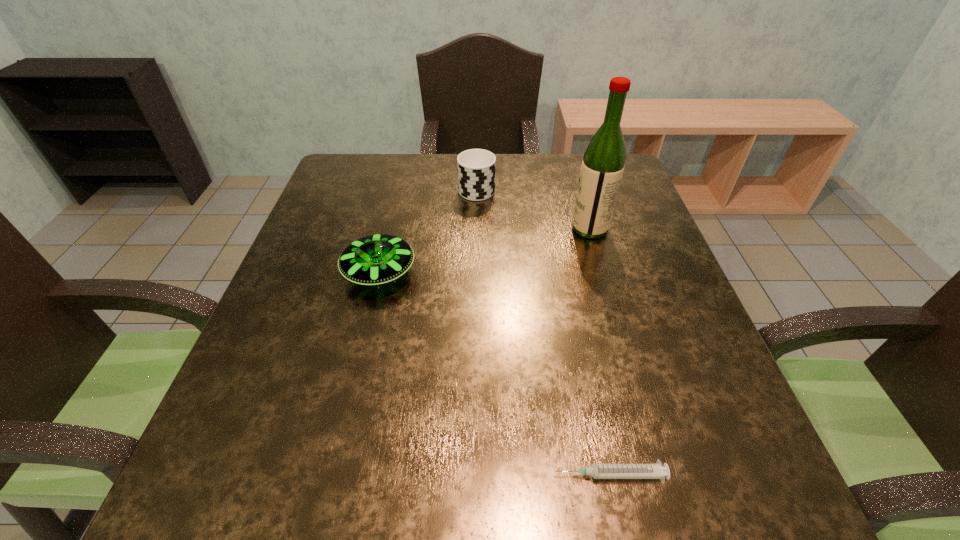
The image size is (960, 540). I want to click on liquor positioned at the right edge, so click(x=603, y=164).

The image size is (960, 540). I want to click on syringe at the right edge, so click(598, 471).

Identify the location of object at the near right corner. (598, 471).

Locate an element on the screen. free space at the far edge is located at coordinates (443, 164).

Locate an element on the screen. This screenshot has height=540, width=960. vacant space at the near edge of the desktop is located at coordinates (338, 471).

This screenshot has width=960, height=540. Find the location of `free space at the left edge of the desktop`. free space at the left edge of the desktop is located at coordinates (298, 256).

This screenshot has height=540, width=960. In the image, there is a desktop. Find the location of `vacant space at the right edge`. vacant space at the right edge is located at coordinates 684,420.

At what (x,y) coordinates should I click in order to perform the action: click on free point at the far left corner. Please return your answer as a coordinate pair (x, y). The image size is (960, 540). Looking at the image, I should click on (368, 173).

In the image, there is a desktop. Identify the location of vacant space at the near left corner. (211, 526).

Where is `free space between the third shortest object and the liquor`? The width and height of the screenshot is (960, 540). free space between the third shortest object and the liquor is located at coordinates (533, 208).